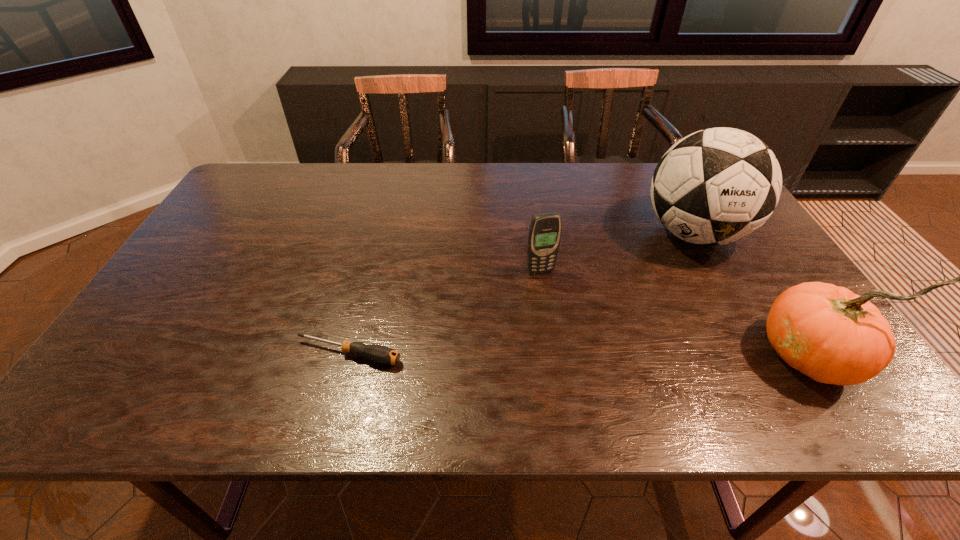
At what (x,y) coordinates should I click in order to perform the action: click on free region located 0.240m on the surface of the soccer ball where the brand logo is visible. Please return your answer as a coordinate pair (x, y). This screenshot has height=540, width=960. Looking at the image, I should click on (632, 310).

Where is `free space located 0.280m on the screen of the second shortest object`? free space located 0.280m on the screen of the second shortest object is located at coordinates click(582, 363).

This screenshot has width=960, height=540. In order to click on free region located 0.290m on the screen of the second shortest object in this screenshot , I will do `click(584, 367)`.

At what (x,y) coordinates should I click in order to perform the action: click on vacant area situated 0.150m on the screen of the second shortest object. Please return your answer as a coordinate pair (x, y). The width and height of the screenshot is (960, 540). Looking at the image, I should click on (563, 319).

You are a GUI agent. You are given a task and a screenshot of the screen. Output one action in this format:
    pyautogui.click(x=<x>, y=<y>)
    Task: Click on the screwdriver present at the near edge
    Image resolution: width=960 pixels, height=540 pixels.
    Given the screenshot: What is the action you would take?
    pyautogui.click(x=380, y=354)

This screenshot has height=540, width=960. What are the coordinates of `pumpkin present at the near edge` in the screenshot? It's located at (827, 332).

Find the location of a particular element. This screenshot has width=960, height=540. pumpkin positioned at the right edge is located at coordinates (827, 332).

Find the location of a particular element. soccer ball positioned at the right edge is located at coordinates (719, 185).

This screenshot has width=960, height=540. I want to click on object that is at the near right corner, so click(827, 332).

Find the location of a particular element. free space at the far edge of the desktop is located at coordinates 420,180.